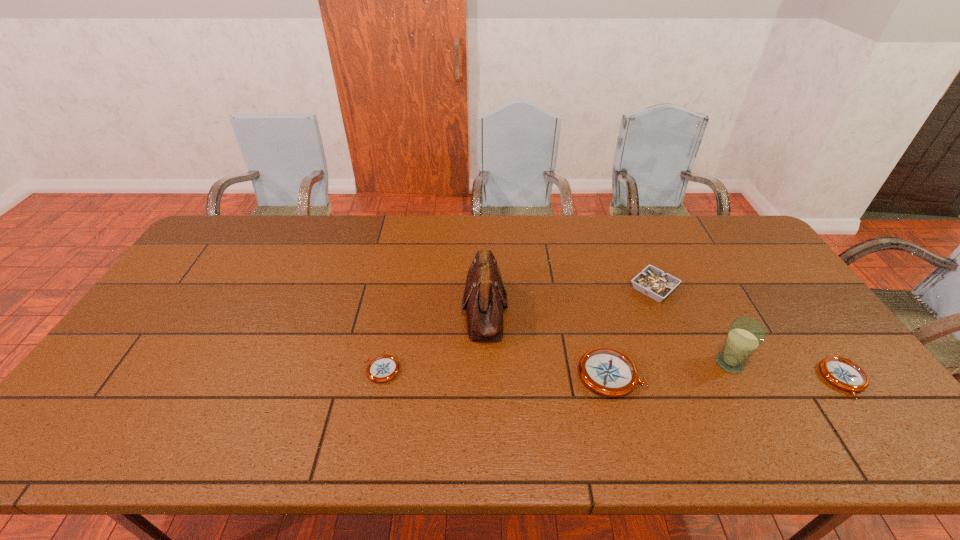
Locate an element on the screen. the leftmost object is located at coordinates (382, 368).

Where is `the shortest compass`? Image resolution: width=960 pixels, height=540 pixels. the shortest compass is located at coordinates (382, 368).

At what (x,y) coordinates should I click in order to perform the action: click on the second compass from right to left. Please return your answer as a coordinate pair (x, y). The width and height of the screenshot is (960, 540). Looking at the image, I should click on (609, 372).

This screenshot has width=960, height=540. I want to click on the tallest compass, so click(x=609, y=372).

You are a GUI agent. You are given a task and a screenshot of the screen. Output one action in this format:
    pyautogui.click(x=<x>, y=<y>)
    Task: Click on the second shortest object
    The image size is (960, 540).
    Given the screenshot: What is the action you would take?
    pyautogui.click(x=841, y=372)

Locate an element on the screen. The width and height of the screenshot is (960, 540). the rightmost object is located at coordinates click(841, 372).

The width and height of the screenshot is (960, 540). I want to click on shoulder bag, so click(x=484, y=298).

You are a GUI agent. You are given a task and a screenshot of the screen. Output one action in this format:
    pyautogui.click(x=<x>, y=<y>)
    Task: Click on the second object from left to right
    The width and height of the screenshot is (960, 540).
    Given the screenshot: What is the action you would take?
    pyautogui.click(x=484, y=298)

What are the coordinates of `ashtray` in the screenshot? It's located at (652, 282).

This screenshot has height=540, width=960. Find the location of `glass`. glass is located at coordinates [745, 335].